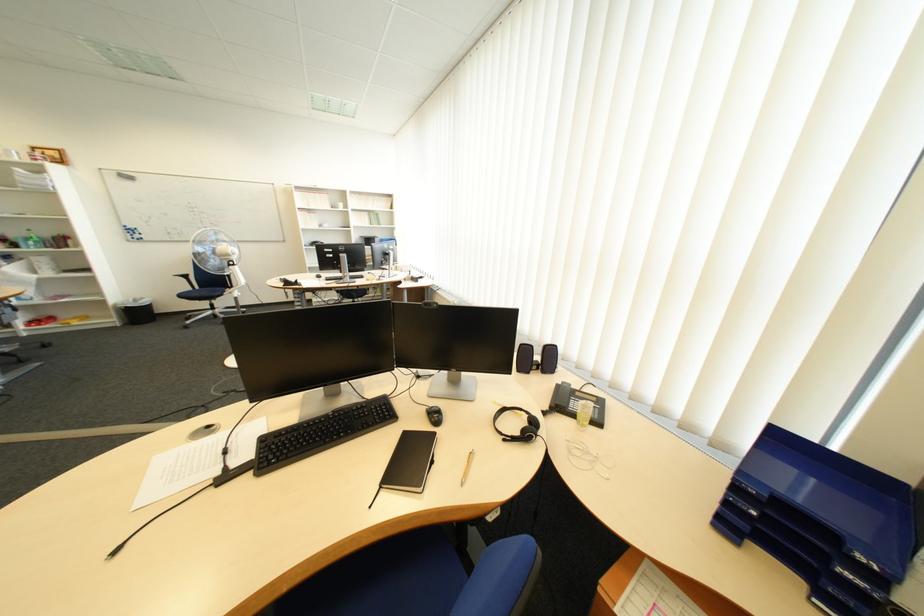
Image resolution: width=924 pixels, height=616 pixels. I want to click on wooden pen, so click(467, 467).